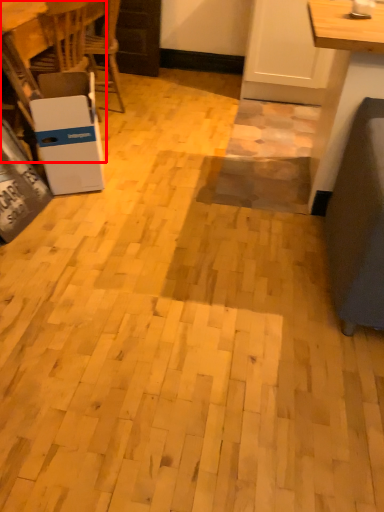
Question: From the image's perspective, considering the relative positions of table (annotated by the red box) and cardboard box in the image provided, where is table (annotated by the red box) located with respect to the staircase?

Choices:
 (A) below
 (B) above

Answer: (B)